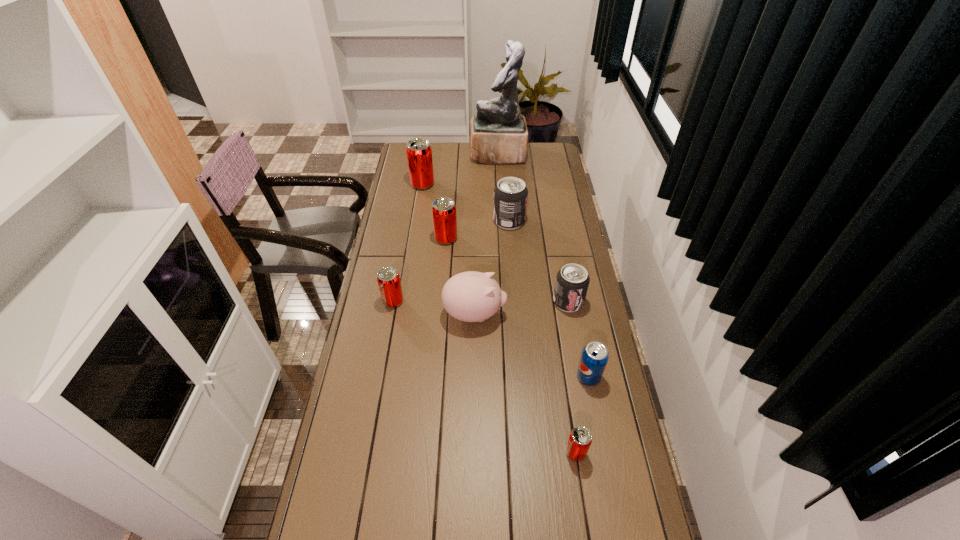
At what (x,y) coordinates should I click in order to perform the action: click on free region at the right edge of the desktop. Please return your answer as a coordinate pair (x, y). The height and width of the screenshot is (540, 960). Looking at the image, I should click on (548, 199).

Image resolution: width=960 pixels, height=540 pixels. Identify the location of free spot between the biggest red soda can and the eighth farthest object. (506, 281).

Where is `free space between the nearer black soda can and the piggy bank`? The height and width of the screenshot is (540, 960). free space between the nearer black soda can and the piggy bank is located at coordinates (521, 308).

Identify the location of vacant area that lies between the eighth shortest object and the eighth farthest object. The height and width of the screenshot is (540, 960). (506, 281).

Locate an element on the screen. This screenshot has width=960, height=540. free space between the fifth soda can from right to left and the fourth soda can from left to right is located at coordinates (478, 230).

This screenshot has height=540, width=960. What are the coordinates of `vacant area that lies between the smaller black soda can and the eighth shortest object` in the screenshot? It's located at point(495,243).

In order to click on free space between the second nearest object and the piggy bank in this screenshot , I will do point(532,346).

The width and height of the screenshot is (960, 540). Identify the location of free space between the third soda can from left to right and the shortest object. (511, 346).

Locate an element on the screen. the fifth closest object to the sculpture is located at coordinates (471, 296).

Choose which object is the third nearest neighbor to the fourth soda can from right to left. Please provide its 2D coordinates. Your answer should be formatted as a tuple, i.e. [(x, y)], where the tuple contains the x and y coordinates of a point satisfying the conditions above.

[(572, 281)]